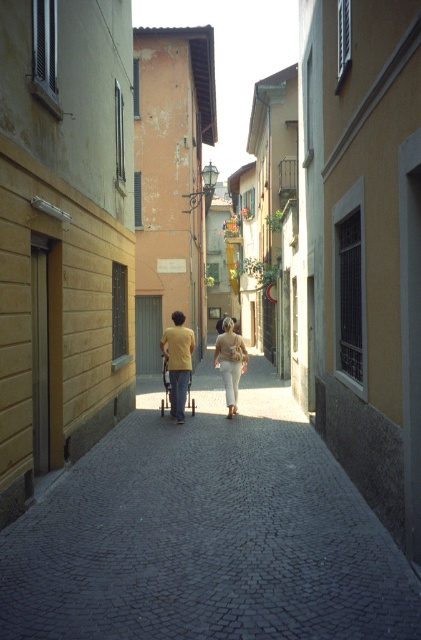
Question: Does yellow matte shirt at center have a smaller size compared to matte beige pants at center?

Choices:
 (A) no
 (B) yes

Answer: (A)

Question: Does yellow matte shirt at center have a larger size compared to matte beige pants at center?

Choices:
 (A) yes
 (B) no

Answer: (A)

Question: Which point appears closest to the camera in this image?

Choices:
 (A) (167, 352)
 (B) (167, 364)

Answer: (A)

Question: Which object is the closest to the yellow matte shirt at center?

Choices:
 (A) matte beige pants at center
 (B) cobblestone alley at center

Answer: (A)

Question: Does yellow cotton shirt at center have a lesser width compared to matte beige pants at center?

Choices:
 (A) no
 (B) yes

Answer: (A)

Question: Estimate the real-world distances between objects in this image. Which object is farther from the yellow matte shirt at center?

Choices:
 (A) cobblestone alley at center
 (B) matte beige pants at center
 (C) yellow cotton shirt at center

Answer: (A)